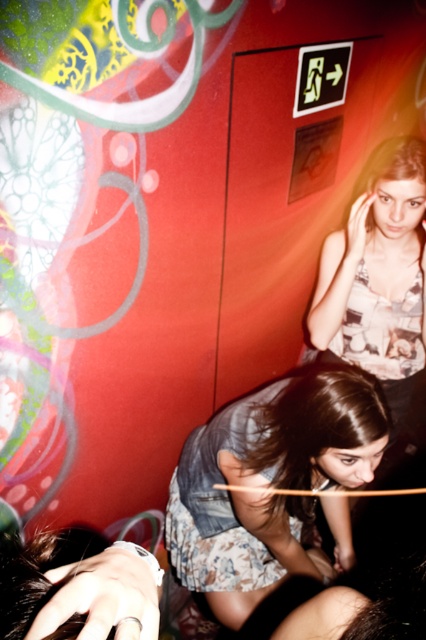
Does denim jacket at lower center appear over matte floral tank top at upper right?

No.

Can you confirm if denim jacket at lower center is shorter than matte floral tank top at upper right?

Correct, denim jacket at lower center is not as tall as matte floral tank top at upper right.

I want to click on denim jacket at lower center, so click(270, 483).